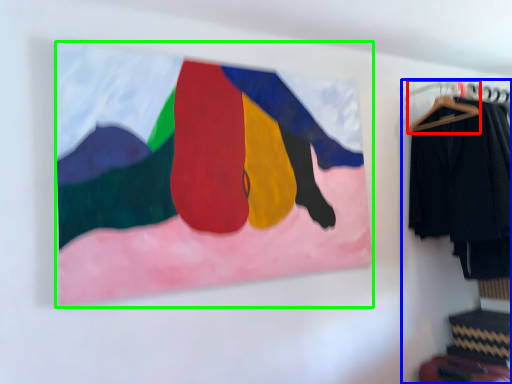
Question: Based on their relative distances, which object is farther from hanger (highlighted by a red box)? Choose from closet (highlighted by a blue box) and picture frame (highlighted by a green box).

Choices:
 (A) closet
 (B) picture frame

Answer: (B)